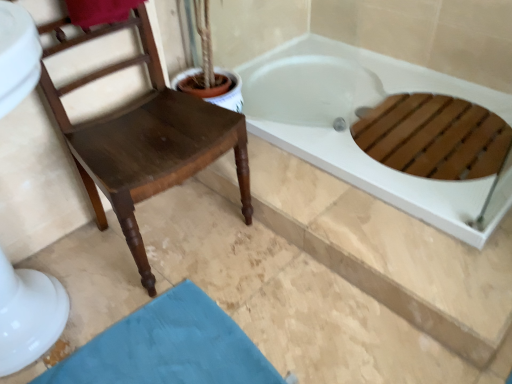
Describe the element at coordinates (144, 138) in the screenshot. This screenshot has width=512, height=384. I see `dark brown wood chair at left` at that location.

Locate an element on the screen. The image size is (512, 384). white glossy bathtub at upper right is located at coordinates (356, 119).

What do you see at coordinates (169, 347) in the screenshot? I see `teal fabric bath mat at lower left` at bounding box center [169, 347].

The height and width of the screenshot is (384, 512). I want to click on dark brown wood chair at left, so click(x=144, y=138).

Is white glossy bathtub at upper right looking in the opposite direction of teal fabric bath mat at lower left?

No, white glossy bathtub at upper right is not facing away from teal fabric bath mat at lower left.

Considering the relative positions of white glossy bathtub at upper right and teal fabric bath mat at lower left in the image provided, is white glossy bathtub at upper right to the left or to the right of teal fabric bath mat at lower left?

From the image, it's evident that white glossy bathtub at upper right is to the right of teal fabric bath mat at lower left.

From the image's perspective, is white glossy bathtub at upper right under teal fabric bath mat at lower left?

Incorrect, from the image's perspective, white glossy bathtub at upper right is higher than teal fabric bath mat at lower left.

Who is more distant, white glossy bathtub at upper right or teal fabric bath mat at lower left?

white glossy bathtub at upper right is further from the camera.

From a real-world perspective, is dark brown wood chair at left below white glossy bathtub at upper right?

No.

Considering the relative sizes of dark brown wood chair at left and white glossy bathtub at upper right in the image provided, is dark brown wood chair at left thinner than white glossy bathtub at upper right?

Yes, dark brown wood chair at left is thinner than white glossy bathtub at upper right.

Is dark brown wood chair at left located outside white glossy bathtub at upper right?

Absolutely, dark brown wood chair at left is external to white glossy bathtub at upper right.

Consider the image. Is dark brown wood chair at left wider or thinner than teal fabric bath mat at lower left?

In the image, dark brown wood chair at left appears to be more narrow than teal fabric bath mat at lower left.

Does dark brown wood chair at left have a larger size compared to teal fabric bath mat at lower left?

Indeed, dark brown wood chair at left has a larger size compared to teal fabric bath mat at lower left.

From their relative heights in the image, would you say dark brown wood chair at left is taller or shorter than teal fabric bath mat at lower left?

Considering their sizes, dark brown wood chair at left has more height than teal fabric bath mat at lower left.

Is dark brown wood chair at left oriented away from teal fabric bath mat at lower left?

dark brown wood chair at left is not turned away from teal fabric bath mat at lower left.

Which of these two, teal fabric bath mat at lower left or dark brown wood chair at left, is bigger?

dark brown wood chair at left is bigger.

From the image's perspective, between teal fabric bath mat at lower left and dark brown wood chair at left, who is located below?

teal fabric bath mat at lower left is shown below in the image.

Can we say teal fabric bath mat at lower left lies outside dark brown wood chair at left?

teal fabric bath mat at lower left lies outside dark brown wood chair at left's area.

Based on the photo, from a real-world perspective, between teal fabric bath mat at lower left and dark brown wood chair at left, who is vertically lower?

In real-world perspective, teal fabric bath mat at lower left is lower.

Can you tell me how much teal fabric bath mat at lower left and white glossy bathtub at upper right differ in facing direction?

The angular difference between teal fabric bath mat at lower left and white glossy bathtub at upper right is 84.3 degrees.

Can we say teal fabric bath mat at lower left lies outside white glossy bathtub at upper right?

Yes, teal fabric bath mat at lower left is not within white glossy bathtub at upper right.

Based on the photo, could you tell me if teal fabric bath mat at lower left is turned towards white glossy bathtub at upper right?

No.

Is there a large distance between teal fabric bath mat at lower left and white glossy bathtub at upper right?

They are positioned close to each other.

In the scene shown: Is the surface of white glossy bathtub at upper right in direct contact with dark brown wood chair at left?

There is a gap between white glossy bathtub at upper right and dark brown wood chair at left.

Considering the points (287, 146) and (139, 134), which point is in front, point (287, 146) or point (139, 134)?

The point (139, 134) is closer.

Based on their positions, is white glossy bathtub at upper right located to the left or right of dark brown wood chair at left?

white glossy bathtub at upper right is to the right of dark brown wood chair at left.

From the image's perspective, who appears lower, white glossy bathtub at upper right or dark brown wood chair at left?

dark brown wood chair at left, from the image's perspective.

Where is `bathtub above the teal fabric bath mat at lower left (from the image's perspective)`? The width and height of the screenshot is (512, 384). bathtub above the teal fabric bath mat at lower left (from the image's perspective) is located at coordinates (356, 119).

In order to click on chair below the white glossy bathtub at upper right (from the image's perspective) in this screenshot , I will do `click(144, 138)`.

Estimate the real-world distances between objects in this image. Which object is closer to teal fabric bath mat at lower left, white glossy bathtub at upper right or dark brown wood chair at left?

dark brown wood chair at left is positioned closer to the anchor teal fabric bath mat at lower left.

Considering their positions, is teal fabric bath mat at lower left positioned closer to white glossy bathtub at upper right than dark brown wood chair at left?

The object closer to white glossy bathtub at upper right is dark brown wood chair at left.

Which object lies nearer to the anchor point dark brown wood chair at left, white glossy bathtub at upper right or teal fabric bath mat at lower left?

teal fabric bath mat at lower left.

Estimate the real-world distances between objects in this image. Which object is further from dark brown wood chair at left, teal fabric bath mat at lower left or white glossy bathtub at upper right?

Based on the image, white glossy bathtub at upper right appears to be further to dark brown wood chair at left.

Estimate the real-world distances between objects in this image. Which object is further from white glossy bathtub at upper right, dark brown wood chair at left or teal fabric bath mat at lower left?

Based on the image, teal fabric bath mat at lower left appears to be further to white glossy bathtub at upper right.

When comparing their distances from teal fabric bath mat at lower left, does dark brown wood chair at left or white glossy bathtub at upper right seem closer?

The object closer to teal fabric bath mat at lower left is dark brown wood chair at left.

Find the location of a particular element. chair between white glossy bathtub at upper right and teal fabric bath mat at lower left from top to bottom is located at coordinates (144, 138).